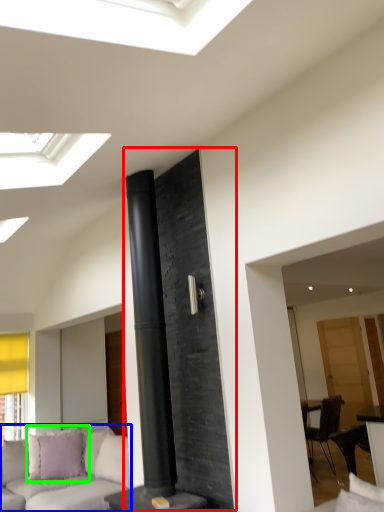
Question: Which is farther away from fireplace (highlighted by a red box)? studio couch (highlighted by a blue box) or pillow (highlighted by a green box)?

Choices:
 (A) studio couch
 (B) pillow

Answer: (B)